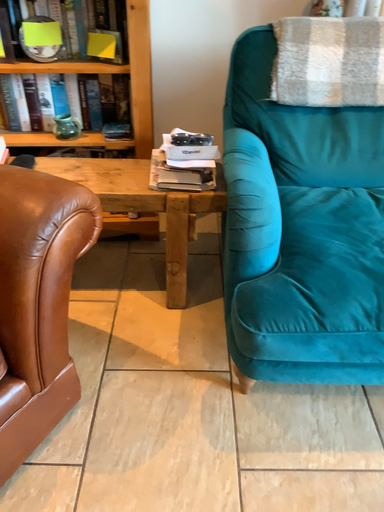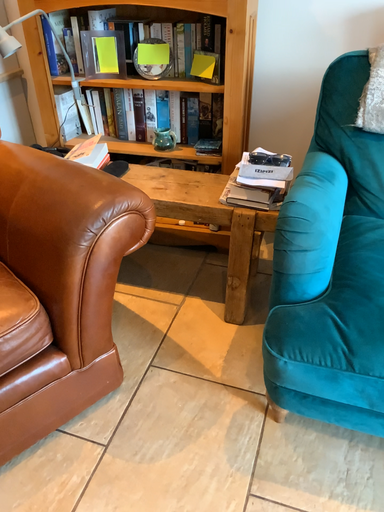
Question: How did the camera likely rotate when shooting the video?

Choices:
 (A) rotated right
 (B) rotated left

Answer: (B)